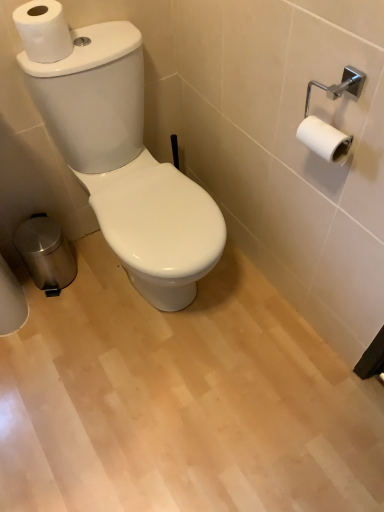
Question: Is the surface of polished stainless steel trash bin at lower left in direct contact with white matte toilet paper at upper left?

Choices:
 (A) no
 (B) yes

Answer: (A)

Question: From a real-world perspective, does polished stainless steel trash bin at lower left stand above white matte toilet paper at upper left?

Choices:
 (A) no
 (B) yes

Answer: (A)

Question: Is polished stainless steel trash bin at lower left oriented towards white matte toilet paper at upper left?

Choices:
 (A) no
 (B) yes

Answer: (A)

Question: Does polished stainless steel trash bin at lower left lie behind white matte toilet paper at upper left?

Choices:
 (A) no
 (B) yes

Answer: (B)

Question: Is polished stainless steel trash bin at lower left taller than white matte toilet paper at upper left?

Choices:
 (A) no
 (B) yes

Answer: (B)

Question: Is polished stainless steel trash bin at lower left to the right of white matte toilet paper at upper left from the viewer's perspective?

Choices:
 (A) yes
 (B) no

Answer: (B)

Question: From a real-world perspective, is white matte toilet paper at upper left physically below white glossy toilet at center?

Choices:
 (A) yes
 (B) no

Answer: (B)

Question: Does white matte toilet paper at upper left turn towards white glossy toilet at center?

Choices:
 (A) no
 (B) yes

Answer: (A)

Question: From the image's perspective, does white matte toilet paper at upper left appear higher than white glossy toilet at center?

Choices:
 (A) no
 (B) yes

Answer: (B)

Question: Is white matte toilet paper at upper left next to white glossy toilet at center and touching it?

Choices:
 (A) yes
 (B) no

Answer: (B)

Question: Does white matte toilet paper at upper left lie behind white glossy toilet at center?

Choices:
 (A) no
 (B) yes

Answer: (B)

Question: From the image's perspective, is white matte toilet paper at upper left beneath white glossy toilet at center?

Choices:
 (A) no
 (B) yes

Answer: (A)

Question: Is white matte toilet paper at upper left surrounding polished stainless steel trash bin at lower left?

Choices:
 (A) yes
 (B) no

Answer: (B)